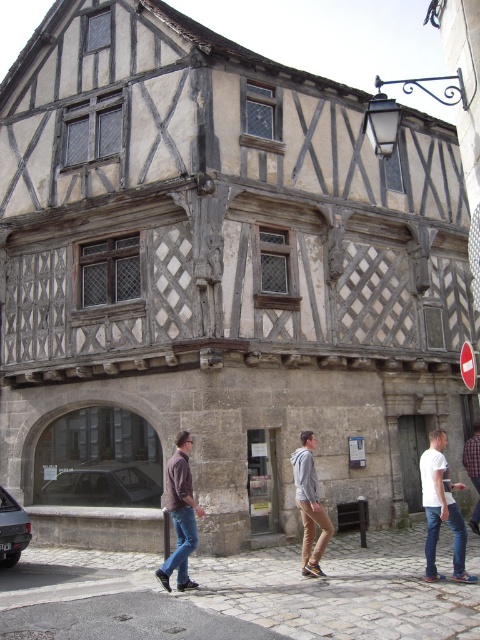
Question: Does white cotton t-shirt at lower right have a greater width compared to brown leather jacket at center?

Choices:
 (A) yes
 (B) no

Answer: (A)

Question: Can you confirm if white cotton t-shirt at lower right is positioned to the right of denim pants at lower right?

Choices:
 (A) no
 (B) yes

Answer: (A)

Question: Estimate the real-world distances between objects in this image. Which object is farther from the white cotton t-shirt at lower right?

Choices:
 (A) brown leather jacket at center
 (B) denim pants at lower right

Answer: (A)

Question: Which object is closer to the camera taking this photo?

Choices:
 (A) brown leather jacket at center
 (B) white cotton t-shirt at lower right

Answer: (A)

Question: Among these points, which one is nearest to the camera?

Choices:
 (A) (300, 433)
 (B) (468, 465)
 (C) (183, 440)
 (D) (425, 547)

Answer: (D)

Question: Can you confirm if gray hoodie at center is positioned to the left of denim pants at lower right?

Choices:
 (A) yes
 (B) no

Answer: (A)